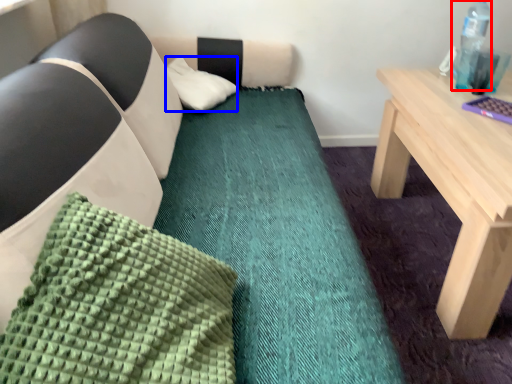
Question: Which of the following is the farthest to the observer, bottle (highlighted by a red box) or pillow (highlighted by a blue box)?

Choices:
 (A) bottle
 (B) pillow

Answer: (B)